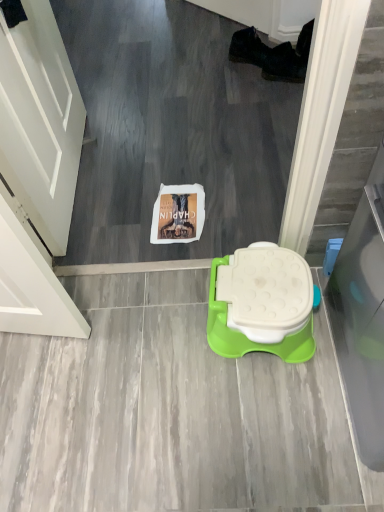
The width and height of the screenshot is (384, 512). I want to click on free space in front of white matte door at upper left, so click(x=106, y=220).